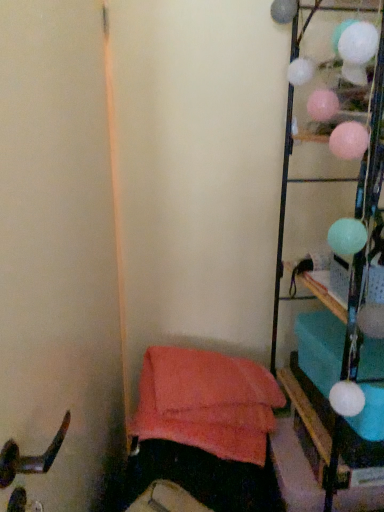
Question: From a real-world perspective, relative to metallic wire rack at right, is soft coral fabric bean bag chair at lower left vertically above or below?

Choices:
 (A) above
 (B) below

Answer: (B)

Question: From the image's perspective, is soft coral fabric bean bag chair at lower left positioned above or below metallic wire rack at right?

Choices:
 (A) above
 (B) below

Answer: (B)

Question: Considering the positions of point (264, 437) and point (281, 242), is point (264, 437) closer or farther from the camera than point (281, 242)?

Choices:
 (A) closer
 (B) farther

Answer: (A)

Question: From their relative heights in the image, would you say metallic wire rack at right is taller or shorter than soft coral fabric bean bag chair at lower left?

Choices:
 (A) tall
 (B) short

Answer: (A)

Question: Looking at their shapes, would you say metallic wire rack at right is wider or thinner than soft coral fabric bean bag chair at lower left?

Choices:
 (A) wide
 (B) thin

Answer: (A)

Question: Would you say metallic wire rack at right is inside or outside soft coral fabric bean bag chair at lower left?

Choices:
 (A) outside
 (B) inside

Answer: (A)

Question: From the image's perspective, is metallic wire rack at right positioned above or below soft coral fabric bean bag chair at lower left?

Choices:
 (A) below
 (B) above

Answer: (B)